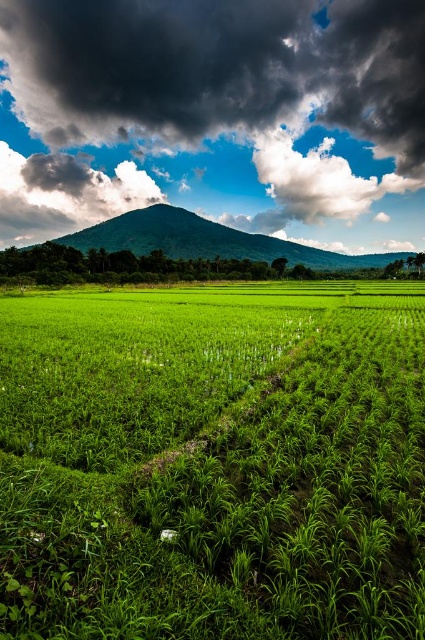
You are a weather observer noting the clouds in the sky. Which cloud, the dark gray cloud at upper center or the white fluffy cloud at upper center, has a greater width?

The dark gray cloud at upper center has a greater width than the white fluffy cloud at upper center according to the description.

You are standing in a rice paddy field and see two points marked in the scene. The first point is at coordinate point(357, 442) and the second is at point(84, 161). Which point is closer to you?

Point(357, 442) is closer to the camera than point(84, 161), so the first point is closer to you.